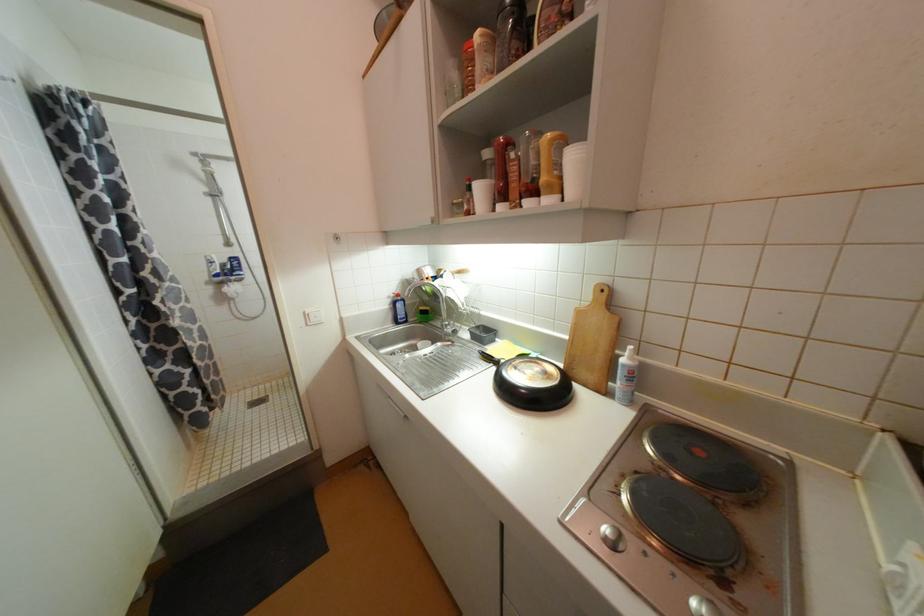
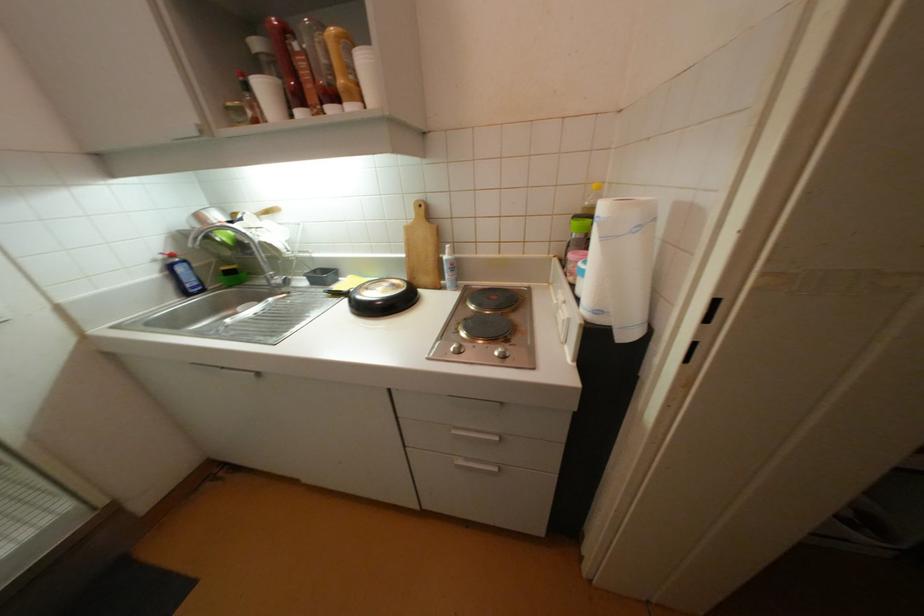
Question: The images are taken continuously from a first-person perspective. In which direction is your viewpoint rotating?

Choices:
 (A) Left
 (B) Right
 (C) Up
 (D) Down

Answer: (B)